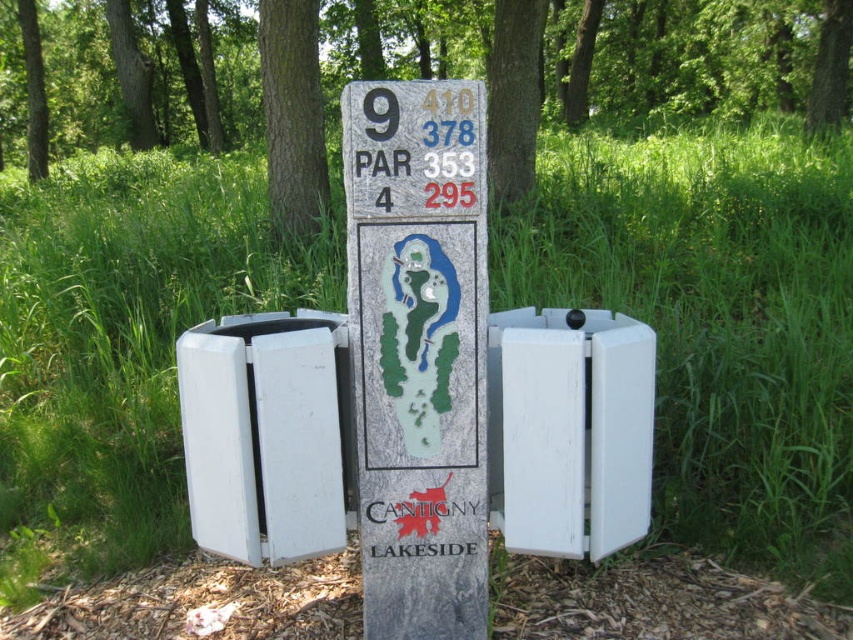
Who is higher up, white plastic trash can at center or brown rough bark tree at upper center?

brown rough bark tree at upper center is above.

Does white plastic trash can at center lie in front of brown rough bark tree at upper center?

Yes, it is.

Is point (326, 440) closer to camera compared to point (294, 189)?

Yes.

Where is `white plastic trash can at center`? This screenshot has width=853, height=640. white plastic trash can at center is located at coordinates (265, 435).

Is white plastic trash can at center shorter than white painted wood at center?

Incorrect, white plastic trash can at center's height does not fall short of white painted wood at center's.

Which is in front, point (299, 522) or point (622, 438)?

Point (622, 438)

Is point (218, 536) farther from camera compared to point (563, 380)?

Yes, point (218, 536) is farther from viewer.

Locate an element on the screen. white plastic trash can at center is located at coordinates [265, 435].

Locate an element on the screen. The width and height of the screenshot is (853, 640). green textured tree at upper center is located at coordinates (555, 67).

Image resolution: width=853 pixels, height=640 pixels. Find the location of `green textured tree at upper center`. green textured tree at upper center is located at coordinates point(555,67).